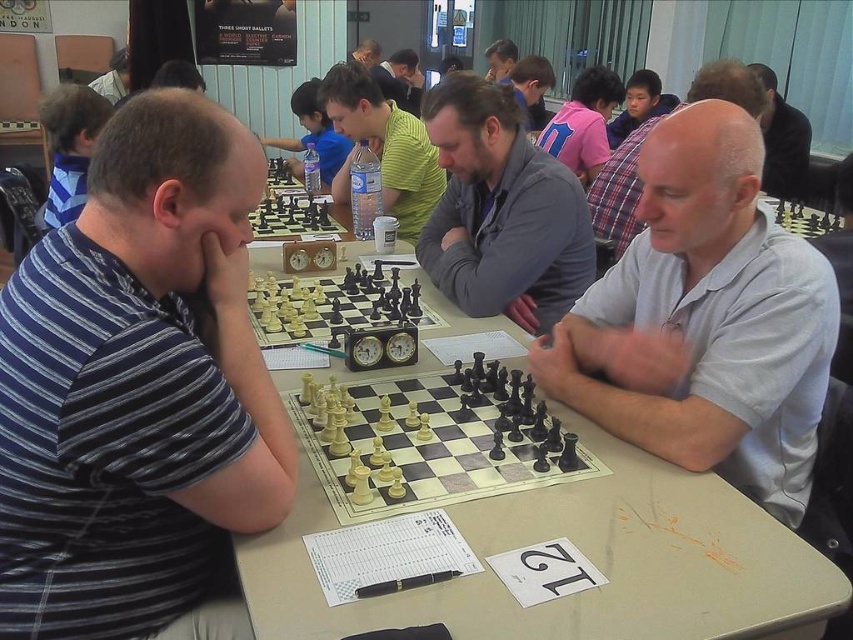
How far apart are black plastic chess set at center and bald white shirt at center?

black plastic chess set at center is 1.24 meters from bald white shirt at center.

Is point (303, 312) positioned after point (616, 192)?

No.

Which is in front, point (340, 300) or point (640, 124)?

Positioned in front is point (340, 300).

Identify the location of black plastic chess set at center. This screenshot has width=853, height=640. [x=331, y=307].

Based on the photo, who is lower down, green striped shirt at center or black plastic chess set at center?

black plastic chess set at center is below.

Can you confirm if green striped shirt at center is positioned below black plastic chess set at center?

Actually, green striped shirt at center is above black plastic chess set at center.

What do you see at coordinates (383, 147) in the screenshot? This screenshot has width=853, height=640. I see `green striped shirt at center` at bounding box center [383, 147].

Where is `green striped shirt at center`? This screenshot has height=640, width=853. green striped shirt at center is located at coordinates (383, 147).

Who is more forward, (770,417) or (409,154)?

Point (770,417)

Who is shorter, white smooth shirt at right or green striped shirt at center?

With less height is green striped shirt at center.

At what (x,y) coordinates should I click in order to perform the action: click on white smooth shirt at right. Please return your answer as a coordinate pair (x, y). The height and width of the screenshot is (640, 853). Looking at the image, I should click on (705, 320).

Locate an element on the screen. white smooth shirt at right is located at coordinates (705, 320).